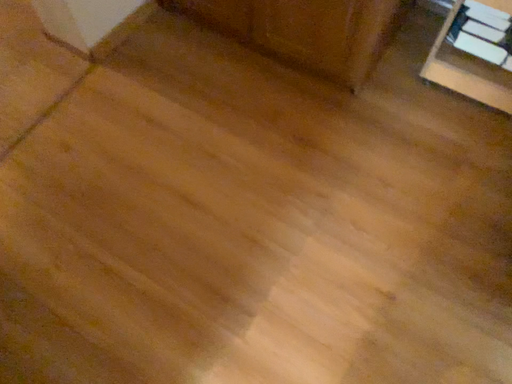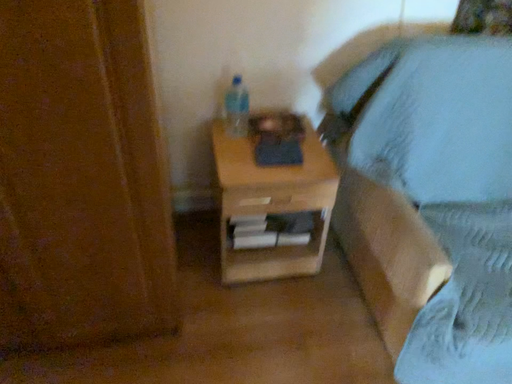
Question: Which way did the camera rotate in the video?

Choices:
 (A) rotated downward
 (B) rotated upward

Answer: (B)